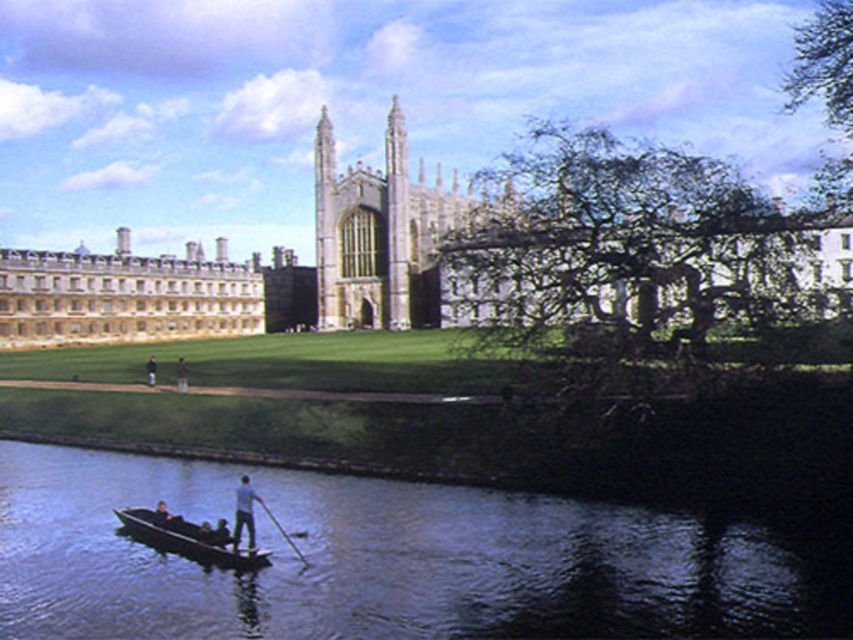
You are a photographer trying to capture the reflection of the Gothic building in the water. You notice the wooden smooth paddle at lower center and the dark blue jeans at center. Which object is more likely to disrupt the water surface and ruin the reflection?

The wooden smooth paddle at lower center is thinner than the dark blue jeans at center, so the paddle is less likely to disrupt the water surface compared to the jeans. However, both objects might affect the reflection depending on their movement.

You are a tourist visiting the university campus and want to take a photo of the dark blue jeans at center and the wooden smooth paddle at lower center. Which object should you focus on first if you want to capture both in the same frame without moving the camera?

The wooden smooth paddle at lower center is located below the dark blue jeans at center, so you should focus on the dark blue jeans at center first to ensure both are in the frame.

You are a photographer planning to capture a candid shot of the two passengers on the punt. The white cotton shirt at lower center and the dark blue jeans at center are both visible. Based on their clothing sizes, which one would you focus on to ensure the subject is clearly visible in the frame?

The dark blue jeans at center should be focused on because the white cotton shirt at lower center is narrower than the dark blue jeans at center, making the jeans a larger target for the camera.